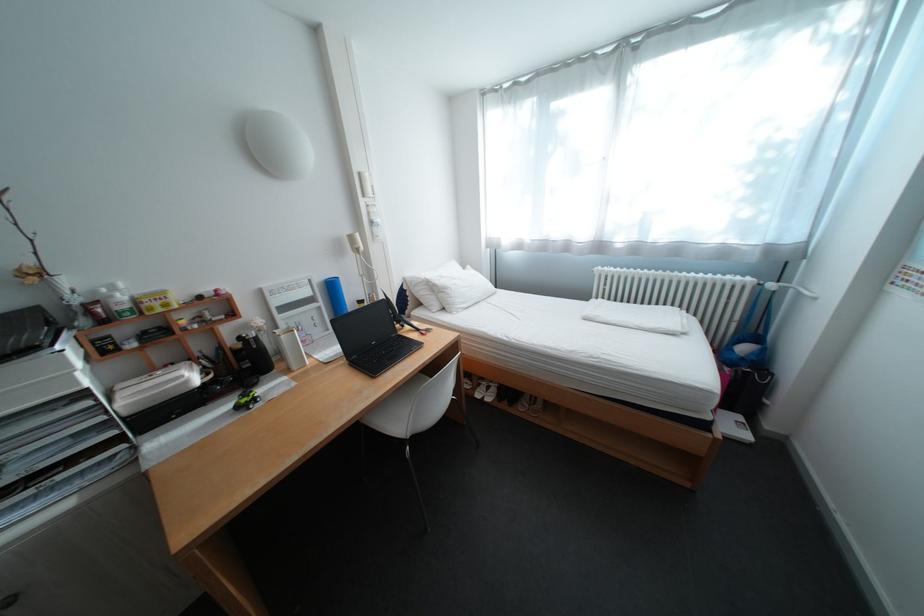
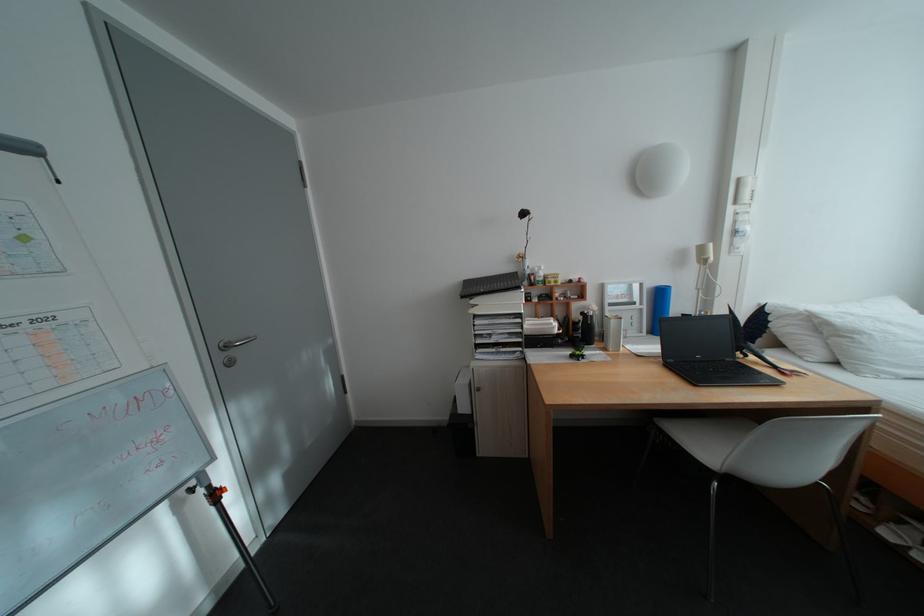
In the second image, find the point that corresponds to the point at 300,371 in the first image.

(617, 350)